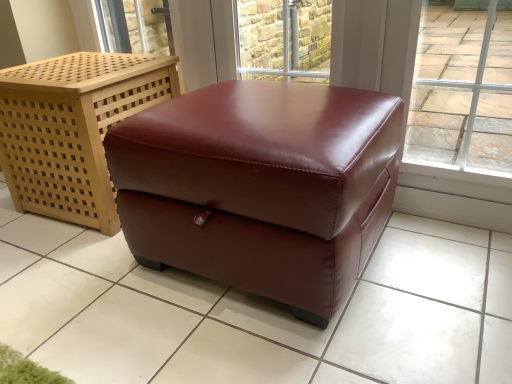
Question: From a real-world perspective, is brick wall at upper center located beneath glossy leather ottoman at center?

Choices:
 (A) no
 (B) yes

Answer: (A)

Question: Is brick wall at upper center far from glossy leather ottoman at center?

Choices:
 (A) no
 (B) yes

Answer: (B)

Question: Can you confirm if brick wall at upper center is shorter than glossy leather ottoman at center?

Choices:
 (A) no
 (B) yes

Answer: (B)

Question: Considering the relative sizes of brick wall at upper center and glossy leather ottoman at center in the image provided, is brick wall at upper center bigger than glossy leather ottoman at center?

Choices:
 (A) no
 (B) yes

Answer: (A)

Question: Does brick wall at upper center lie behind glossy leather ottoman at center?

Choices:
 (A) no
 (B) yes

Answer: (B)

Question: Do you think brick wall at upper center is within glossy leather ottoman at center, or outside of it?

Choices:
 (A) inside
 (B) outside

Answer: (B)

Question: From a real-world perspective, is brick wall at upper center physically located above or below glossy leather ottoman at center?

Choices:
 (A) below
 (B) above

Answer: (B)

Question: From their relative heights in the image, would you say brick wall at upper center is taller or shorter than glossy leather ottoman at center?

Choices:
 (A) tall
 (B) short

Answer: (B)

Question: Based on their sizes in the image, would you say brick wall at upper center is bigger or smaller than glossy leather ottoman at center?

Choices:
 (A) big
 (B) small

Answer: (B)

Question: Considering the positions of point (264, 221) and point (268, 69), is point (264, 221) closer or farther from the camera than point (268, 69)?

Choices:
 (A) closer
 (B) farther

Answer: (A)

Question: From the image's perspective, is glossy leather ottoman at center above or below brick wall at upper center?

Choices:
 (A) below
 (B) above

Answer: (A)

Question: Is glossy leather ottoman at center inside or outside of brick wall at upper center?

Choices:
 (A) outside
 (B) inside

Answer: (A)

Question: From a real-world perspective, is glossy leather ottoman at center above or below brick wall at upper center?

Choices:
 (A) above
 (B) below

Answer: (B)

Question: From their relative heights in the image, would you say burgundy leather ottoman at center is taller or shorter than glossy leather ottoman at center?

Choices:
 (A) short
 (B) tall

Answer: (B)

Question: In terms of width, does burgundy leather ottoman at center look wider or thinner when compared to glossy leather ottoman at center?

Choices:
 (A) wide
 (B) thin

Answer: (B)